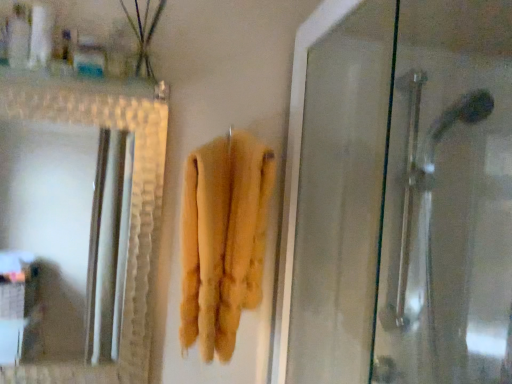
Question: Is translucent plastic container at upper left, the first toiletry viewed from the right, facing towards yellow fluffy towel at center?

Choices:
 (A) yes
 (B) no

Answer: (B)

Question: From the image's perspective, is translucent plastic container at upper left, arranged as the second toiletry when viewed from the left, beneath yellow fluffy towel at center?

Choices:
 (A) yes
 (B) no

Answer: (B)

Question: Is translucent plastic container at upper left, arranged as the second toiletry when viewed from the left, at the left side of yellow fluffy towel at center?

Choices:
 (A) no
 (B) yes

Answer: (B)

Question: Is translucent plastic container at upper left, arranged as the second toiletry when viewed from the left, bigger than yellow fluffy towel at center?

Choices:
 (A) yes
 (B) no

Answer: (B)

Question: Is translucent plastic container at upper left, the first toiletry viewed from the right, wider than yellow fluffy towel at center?

Choices:
 (A) yes
 (B) no

Answer: (B)

Question: Does translucent plastic container at upper left, arranged as the second toiletry when viewed from the left, touch yellow fluffy towel at center?

Choices:
 (A) yes
 (B) no

Answer: (B)

Question: Can you confirm if green matte plant at upper left is thinner than yellow fluffy towel at center?

Choices:
 (A) no
 (B) yes

Answer: (B)

Question: Is green matte plant at upper left not near yellow fluffy towel at center?

Choices:
 (A) yes
 (B) no

Answer: (B)

Question: Considering the relative positions of green matte plant at upper left and yellow fluffy towel at center in the image provided, is green matte plant at upper left to the left of yellow fluffy towel at center from the viewer's perspective?

Choices:
 (A) yes
 (B) no

Answer: (A)

Question: Can you confirm if green matte plant at upper left is shorter than yellow fluffy towel at center?

Choices:
 (A) no
 (B) yes

Answer: (B)

Question: Is green matte plant at upper left smaller than yellow fluffy towel at center?

Choices:
 (A) yes
 (B) no

Answer: (A)

Question: From the image's perspective, does green matte plant at upper left appear lower than yellow fluffy towel at center?

Choices:
 (A) yes
 (B) no

Answer: (B)

Question: Is translucent plastic container at upper left, the first toiletry viewed from the right, bigger than white plastic container at upper left, which is counted as the 2th toiletry, starting from the right?

Choices:
 (A) yes
 (B) no

Answer: (A)